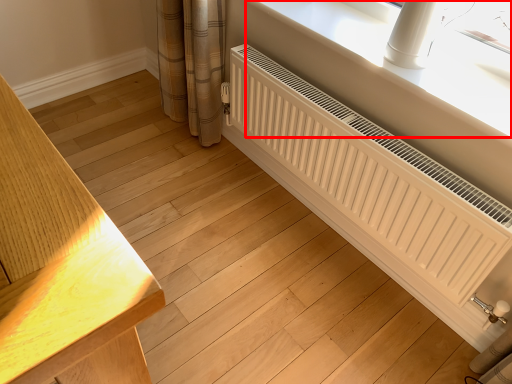
Question: From the image, what is the correct spatial relationship of window sill (annotated by the red box) in relation to radiator?

Choices:
 (A) right
 (B) left

Answer: (A)